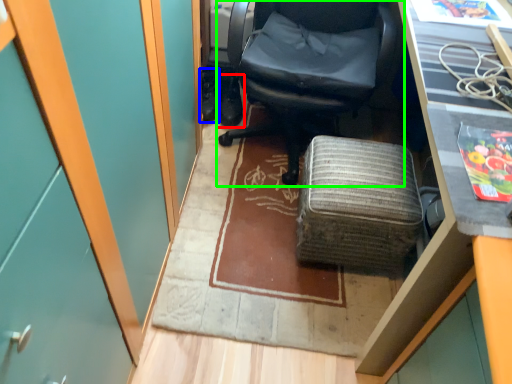
Question: Estimate the real-world distances between objects in this image. Which object is farther from footwear (highlighted by a red box), footwear (highlighted by a blue box) or chair (highlighted by a green box)?

Choices:
 (A) footwear
 (B) chair

Answer: (B)